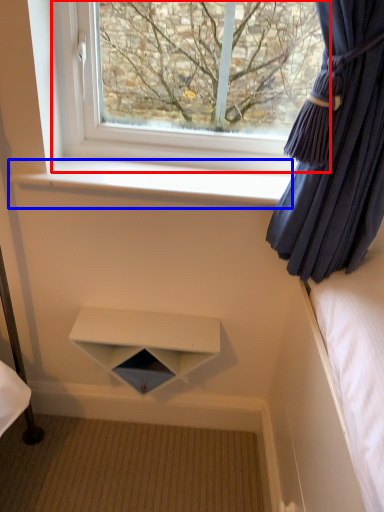
Question: Which object is further to the camera taking this photo, window (highlighted by a red box) or window sill (highlighted by a blue box)?

Choices:
 (A) window
 (B) window sill

Answer: (B)